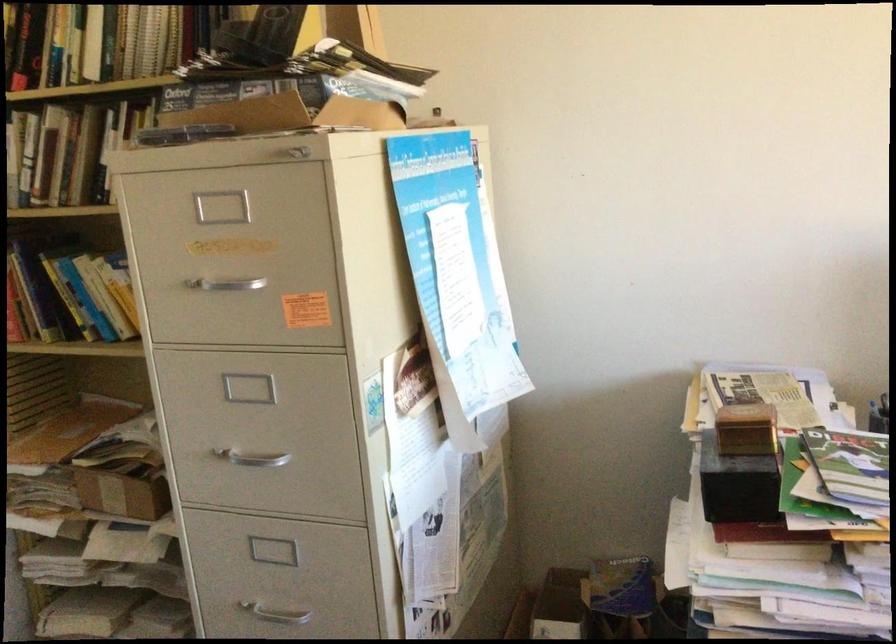
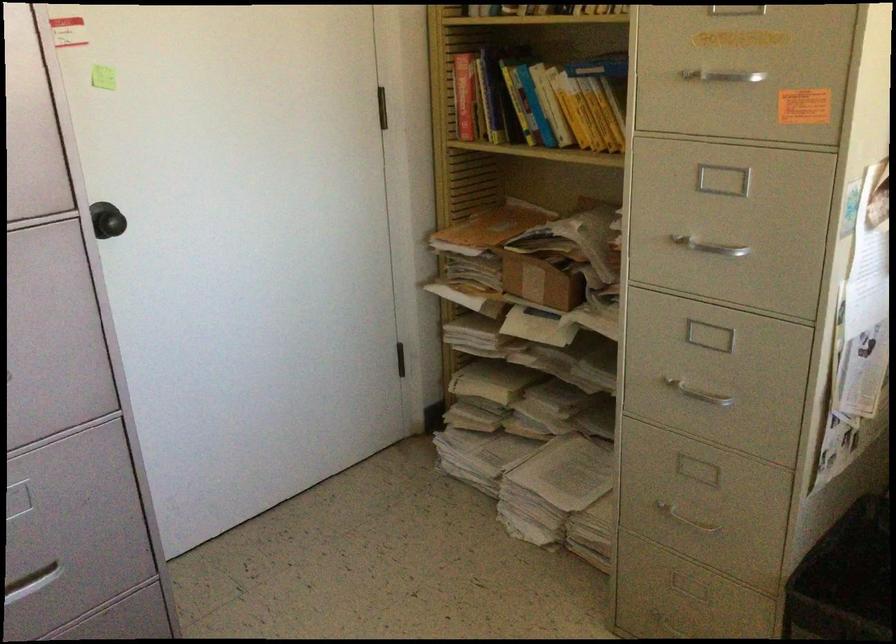
In the second image, find the point that corresponds to (231,289) in the first image.

(725, 82)